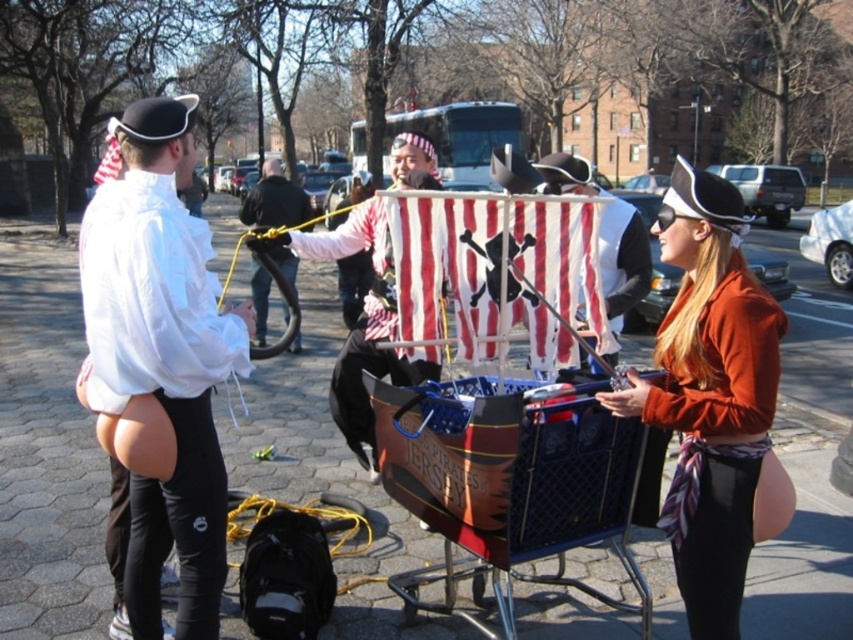
You are a photographer at the event and need to capture a photo where both the white matte shirt at left and the matte white pirate hat at center are clearly visible. Considering their sizes, which object should you focus on first to ensure it doesn

The white matte shirt at left is smaller than the matte white pirate hat at center. To ensure both are clearly visible, focus on the smaller white matte shirt at left first, as it requires more precise framing to capture its details before adjusting for the larger matte white pirate hat at center.

You are standing in the street scene and want to determine which of the two points, point (x=120, y=396) or point (x=368, y=369), is nearer to you. Based on the scene description, which point is closer?

Point (x=120, y=396) is closer to the viewer than point (x=368, y=369).

You are a photographer trying to capture a clear shot of both the white matte shirt at left and the matte white pirate hat at center. Since you want both subjects in focus, you need to know their vertical positions. Which one is lower in the image?

The white matte shirt at left is positioned under the matte white pirate hat at center, so the white matte shirt at left is lower in the image.